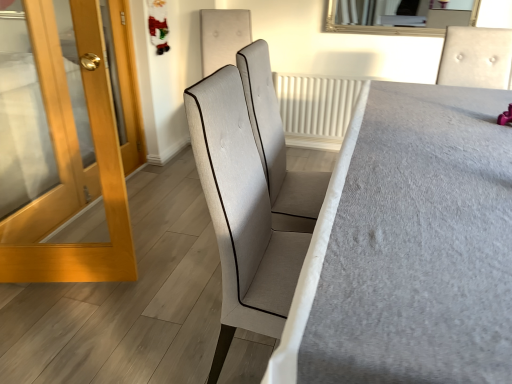
You are a GUI agent. You are given a task and a screenshot of the screen. Output one action in this format:
    pyautogui.click(x=<x>, y=<y>)
    Task: Click on the vacant space behind wooden glossy door at left
    The width and height of the screenshot is (512, 384).
    Given the screenshot: What is the action you would take?
    pyautogui.click(x=106, y=226)